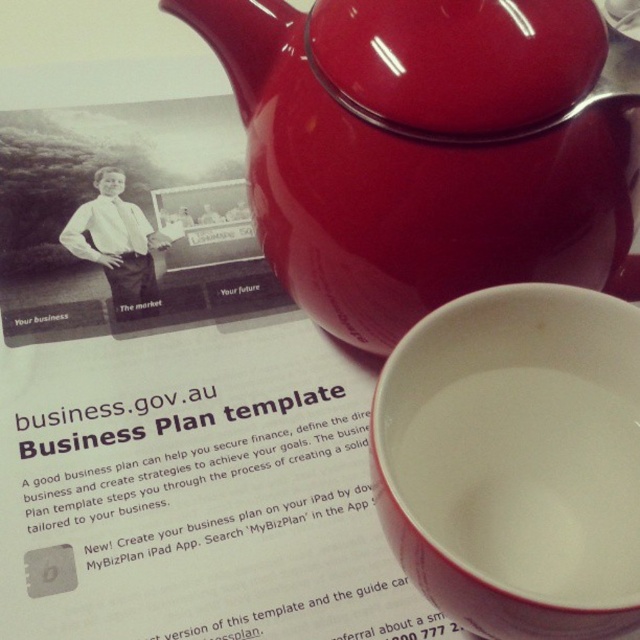
What is the spatial relationship between the glossy ceramic teapot at upper center and the white glossy teacup at lower right in the image?

The glossy ceramic teapot at upper center is closer to the viewer than the white glossy teacup at lower right.

You are a barista who needs to pour tea from the glossy ceramic teapot at upper center into the white glossy teacup at lower right. The teapot has a capacity of 1 liter and is currently full. The teacup can hold 250 milliliters. How many full teacups can you pour before the teapot is empty?

The teapot has a capacity of 1 liter, which is 1000 milliliters. Each teacup holds 250 milliliters. Dividing 1000 by 250 gives exactly 4. Therefore, you can pour 4 full teacups from the glossy ceramic teapot at upper center into the white glossy teacup at lower right before it is empty.

You are organizing a business meeting and need to place a name tag between the glossy ceramic teapot at upper center and the white glossy teacup at lower right. Based on their positions, where should you position the name tag?

The name tag should be placed between the glossy ceramic teapot at upper center and the white glossy teacup at lower right since the teapot is to the left of the teacup.